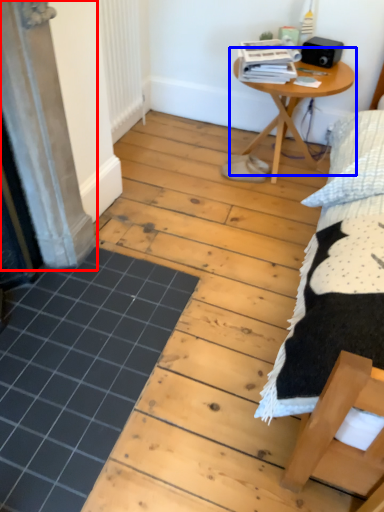
Question: Which of the following is the closest to the observer, screen door (highlighted by a red box) or table (highlighted by a blue box)?

Choices:
 (A) screen door
 (B) table

Answer: (A)